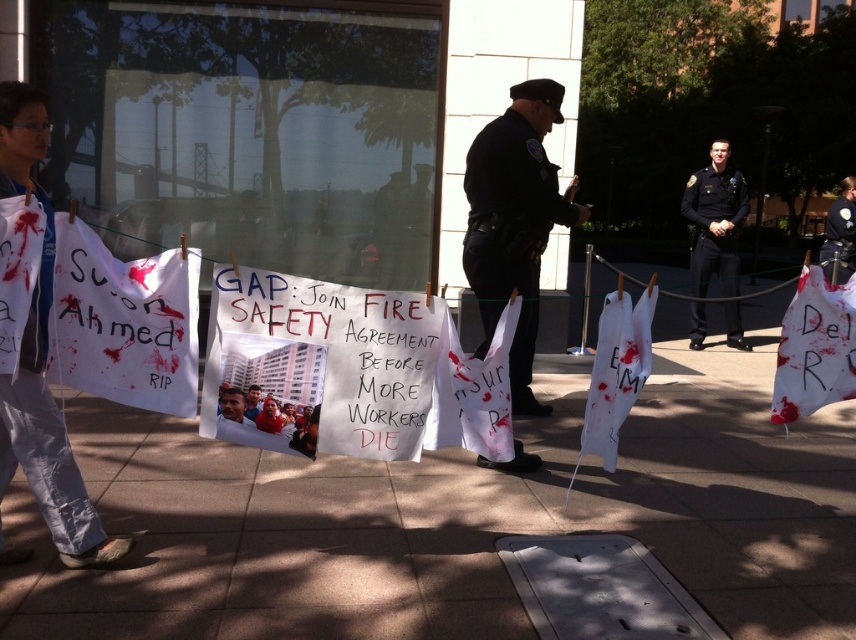
Question: Which object appears closest to the camera in this image?

Choices:
 (A) white cloth at left
 (B) brown concrete pavement at lower center

Answer: (A)

Question: Considering the real-world distances, which object is closest to the brown concrete pavement at lower center?

Choices:
 (A) dark blue uniform at center
 (B) dark blue uniform at right
 (C) matte white shirt at center
 (D) white cloth at left

Answer: (A)

Question: Can you confirm if dark blue uniform at center is positioned to the right of white cloth at left?

Choices:
 (A) no
 (B) yes

Answer: (B)

Question: Is brown concrete pavement at lower center smaller than dark blue uniform at right?

Choices:
 (A) no
 (B) yes

Answer: (B)

Question: Which point is farther to the camera?

Choices:
 (A) (512, 154)
 (B) (811, 508)

Answer: (A)

Question: From the image, what is the correct spatial relationship of brown concrete pavement at lower center in relation to white cloth at left?

Choices:
 (A) right
 (B) left

Answer: (A)